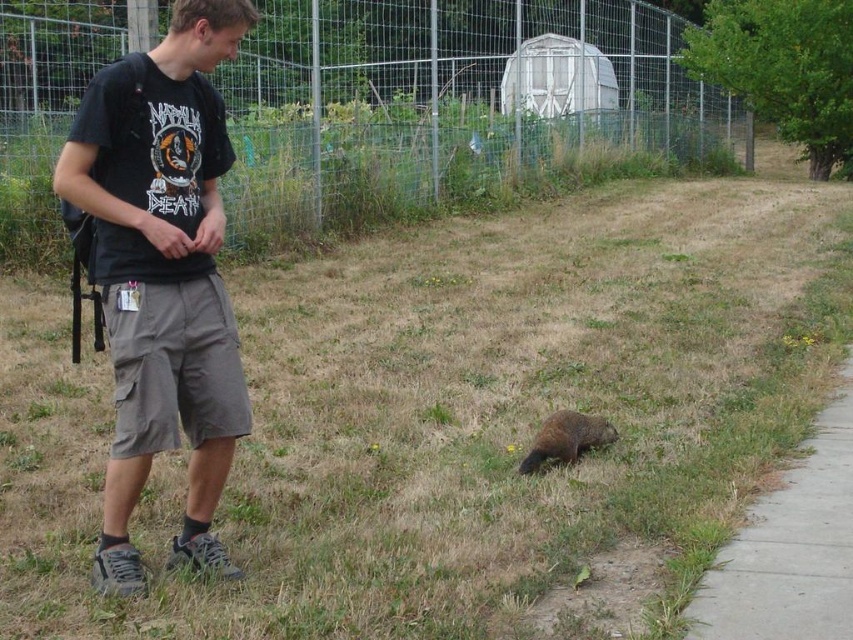
Who is lower down, black cotton t-shirt at upper left or concrete at lower right?

Positioned lower is concrete at lower right.

Does black cotton t-shirt at upper left have a greater height compared to concrete at lower right?

Yes, black cotton t-shirt at upper left is taller than concrete at lower right.

Identify the location of black cotton t-shirt at upper left. The width and height of the screenshot is (853, 640). (161, 275).

Is point (842, 612) more distant than point (561, 424)?

That is False.

Find the location of `concrete at lower right`. concrete at lower right is located at coordinates (790, 547).

Measure the distance between metallic wire fence at upper center and concrete at lower right.

9.29 meters

Is metallic wire fence at upper center wider than concrete at lower right?

Correct, the width of metallic wire fence at upper center exceeds that of concrete at lower right.

Find the location of a particular element. The image size is (853, 640). metallic wire fence at upper center is located at coordinates (444, 99).